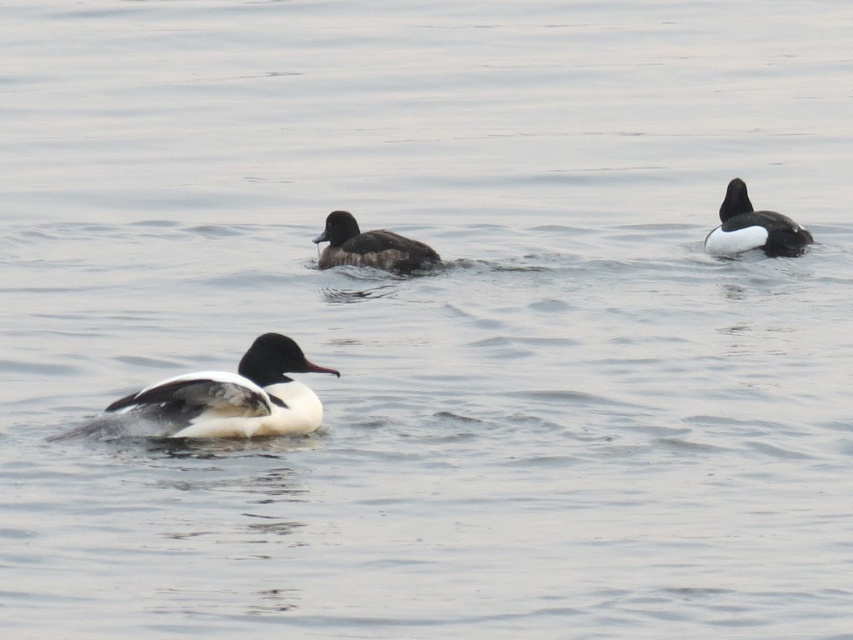
You are a birdwatcher observing the ducks in the image. You notice two white matte ducks. Which one is closer to you, the white matte duck at center or the white matte duck at upper right?

The white matte duck at center is closer to you because it is in front of the white matte duck at upper right.

You are observing two ducks in the water. The white matte duck at center and the white matte duck at upper right. Which duck appears smaller in height?

The white matte duck at center has a lesser height compared to the white matte duck at upper right, so the white matte duck at center appears smaller in height.

In the scene shown: You are a birdwatcher observing the ducks in the scene. You notice the white matte duck at upper right and the dark brown feathers at center. Which duck is positioned higher in the image?

The white matte duck at upper right is positioned higher in the image than the dark brown feathers at center.